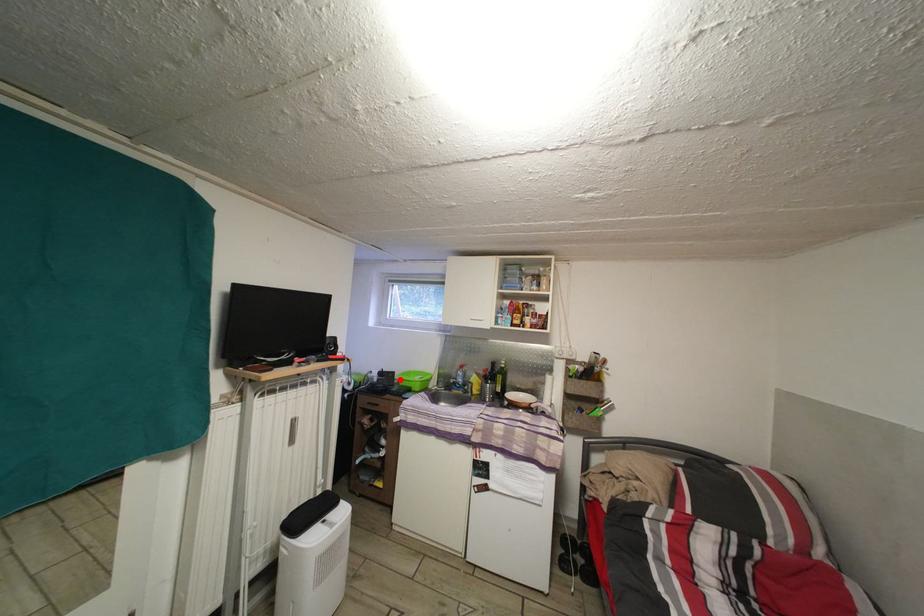
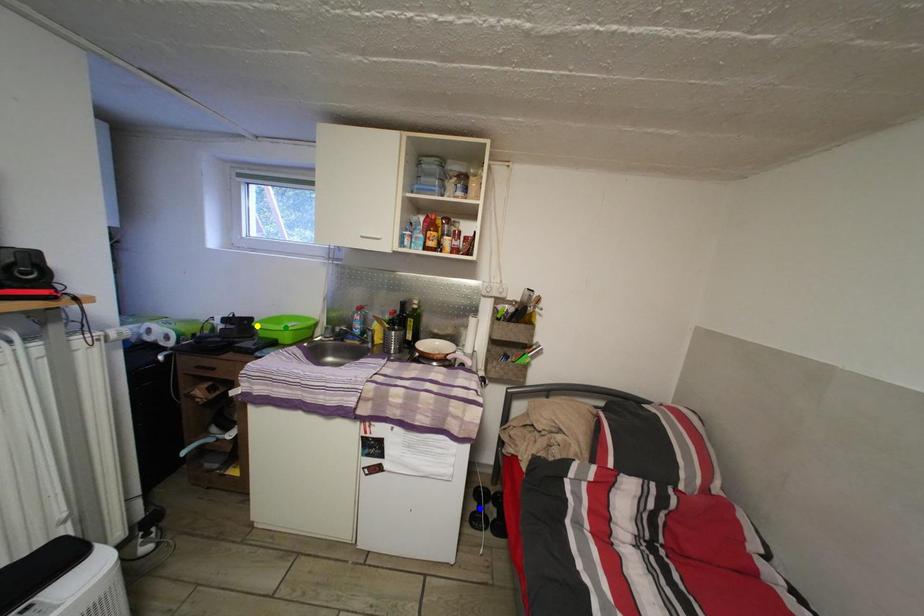
Question: I am providing you with two images of the same scene from different viewpoints. A red point is marked on the first image. You are given multiple points on the second image. Which point in image 2 represents the same 3d spot as the red point in image 1?

Choices:
 (A) yellow point
 (B) green point
 (C) blue point

Answer: (A)